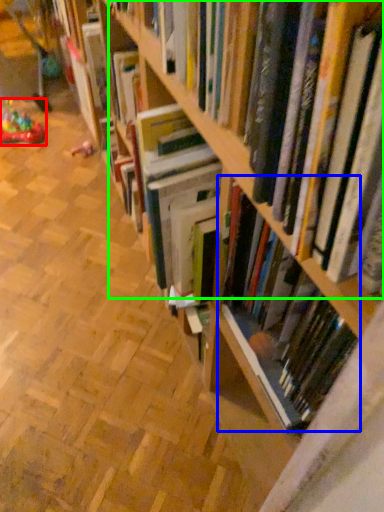
Question: Which object is positioned closest to toy (highlighted by a red box)? Select from book (highlighted by a blue box) and book (highlighted by a green box).

Choices:
 (A) book
 (B) book

Answer: (B)